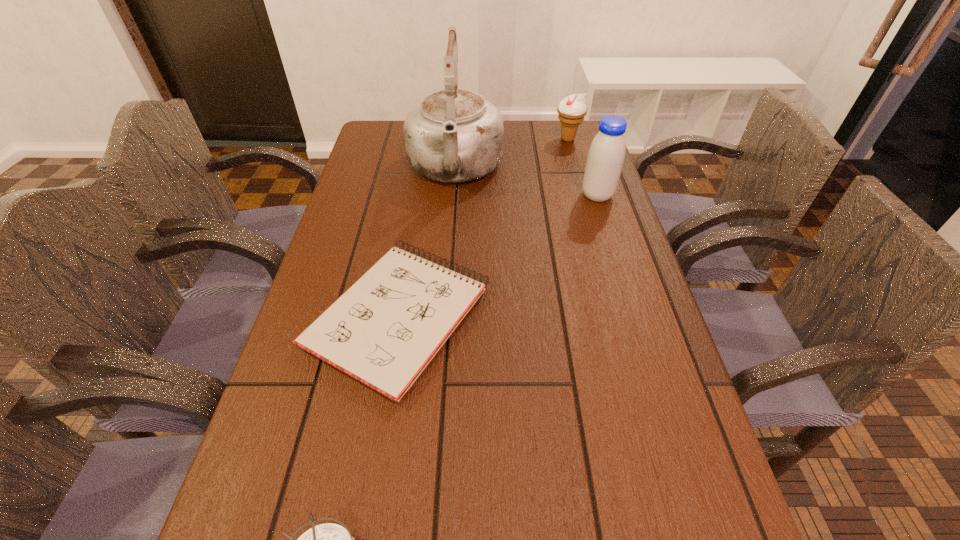
Find the location of `icecream that is at the far edge`. icecream that is at the far edge is located at coordinates (572, 109).

The image size is (960, 540). Find the location of `kettle at the left edge`. kettle at the left edge is located at coordinates click(x=454, y=135).

I want to click on notepad present at the left edge, so click(x=383, y=331).

I want to click on soya milk that is at the right edge, so click(606, 155).

Where is `icecream that is positioned at the right edge`? The image size is (960, 540). icecream that is positioned at the right edge is located at coordinates (572, 109).

Image resolution: width=960 pixels, height=540 pixels. I want to click on object at the far left corner, so click(x=454, y=135).

This screenshot has width=960, height=540. I want to click on object that is at the far right corner, so click(x=572, y=109).

Image resolution: width=960 pixels, height=540 pixels. In the image, there is a desktop. Find the location of `free region at the left edge`. free region at the left edge is located at coordinates (294, 434).

Locate an element on the screen. The image size is (960, 540). free region at the right edge of the desktop is located at coordinates (690, 406).

Locate an element on the screen. This screenshot has height=540, width=960. vacant region at the far left corner of the desktop is located at coordinates (381, 135).